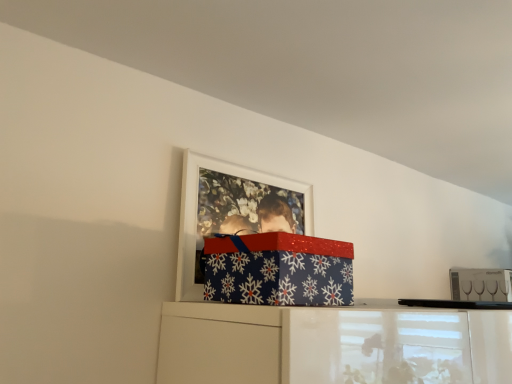
Question: Is white matte picture frame at upper center inside the boundaries of clear glass wine glasses at upper right, or outside?

Choices:
 (A) outside
 (B) inside

Answer: (A)

Question: Considering the positions of white matte picture frame at upper center and clear glass wine glasses at upper right in the image, is white matte picture frame at upper center bigger or smaller than clear glass wine glasses at upper right?

Choices:
 (A) small
 (B) big

Answer: (A)

Question: Which is nearer to the clear glass wine glasses at upper right?

Choices:
 (A) white matte picture frame at upper center
 (B) blue paper with snowflakes at upper center

Answer: (A)

Question: Which object is the farthest from the white matte picture frame at upper center?

Choices:
 (A) clear glass wine glasses at upper right
 (B) blue paper with snowflakes at upper center

Answer: (A)